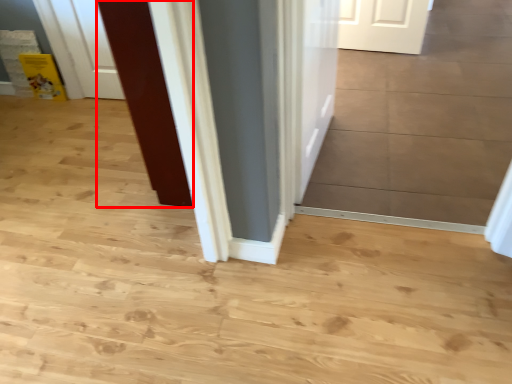
Question: From the image's perspective, considering the relative positions of door (annotated by the red box) and door in the image provided, where is door (annotated by the red box) located with respect to the staircase?

Choices:
 (A) above
 (B) below

Answer: (B)